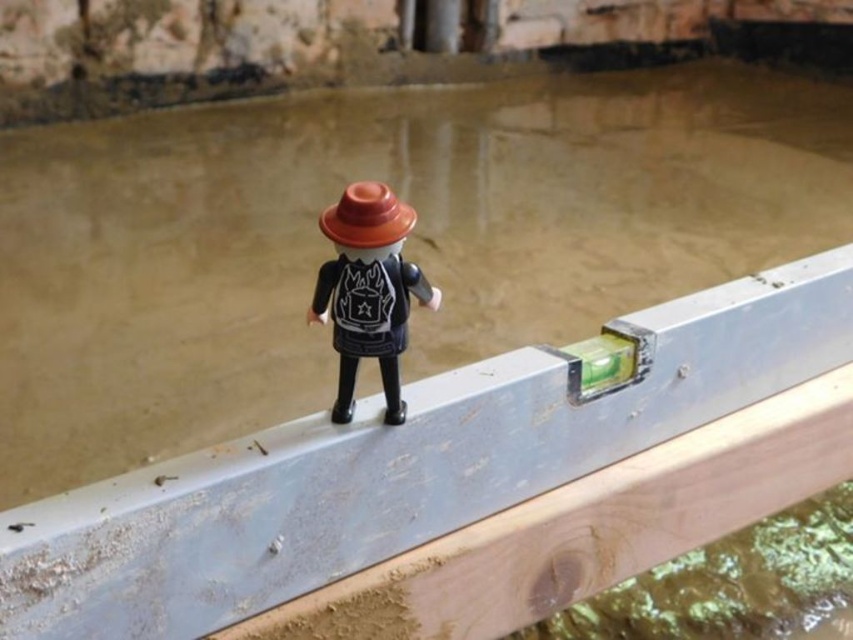
Looking at this image, you are a construction worker inspecting the site. The toy figure is part of a scale model. If you need to place a new beam that must be aligned horizontally using the level tool, where should you position the level relative to the matte black figure at center to ensure proper alignment?

To ensure proper alignment, position the level tool on the metallic beam in front of the matte black figure at center, as the level tool is already resting there, indicating the correct horizontal position.